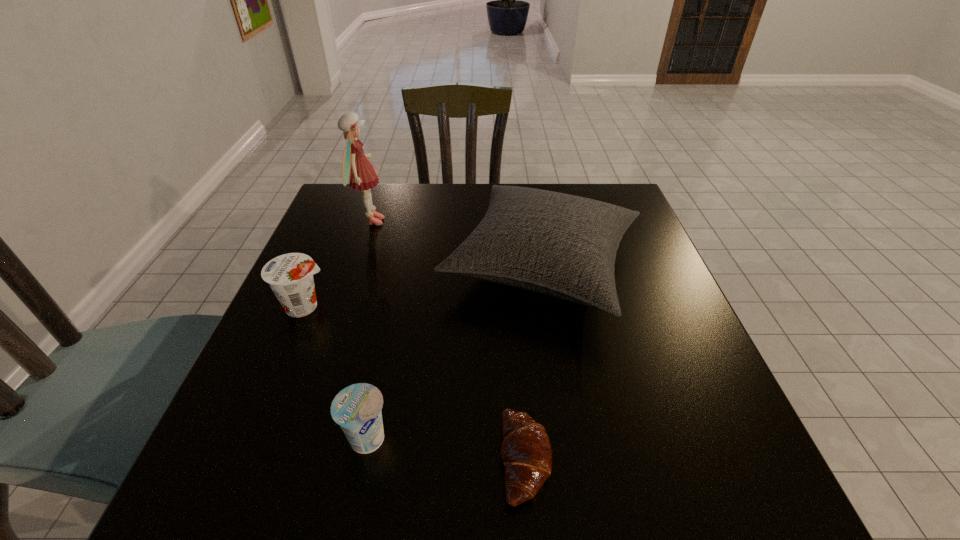
The image size is (960, 540). What are the coordinates of `free area in between the left yogurt and the cushion` in the screenshot? It's located at (423, 286).

The height and width of the screenshot is (540, 960). I want to click on unoccupied position between the tallest object and the crescent roll, so tap(448, 340).

You are a GUI agent. You are given a task and a screenshot of the screen. Output one action in this format:
    pyautogui.click(x=<x>, y=<y>)
    Task: Click on the blank region between the fourth shortest object and the farther yogurt
    This screenshot has width=960, height=540.
    Given the screenshot: What is the action you would take?
    pyautogui.click(x=423, y=286)

I want to click on vacant area between the right yogurt and the farther yogurt, so click(336, 374).

The height and width of the screenshot is (540, 960). I want to click on blank region between the cushion and the nearer yogurt, so click(454, 354).

Where is `free space that is in between the left yogurt and the doll`? This screenshot has height=540, width=960. free space that is in between the left yogurt and the doll is located at coordinates (338, 264).

Select which object is the fourth closest to the left yogurt. Please provide its 2D coordinates. Your answer should be formatted as a tuple, i.e. [(x, y)], where the tuple contains the x and y coordinates of a point satisfying the conditions above.

[(526, 453)]

Identify which object is the second closest to the crescent roll. Please provide its 2D coordinates. Your answer should be formatted as a tuple, i.e. [(x, y)], where the tuple contains the x and y coordinates of a point satisfying the conditions above.

[(357, 408)]

Locate an element on the screen. This screenshot has height=540, width=960. free space that satisfies the following two spatial constraints: 1. on the back side of the second tallest object; 2. on the left side of the farther yogurt is located at coordinates (323, 266).

This screenshot has height=540, width=960. I want to click on vacant space that satisfies the following two spatial constraints: 1. on the front-facing side of the shortest object; 2. on the right side of the doll, so click(x=292, y=459).